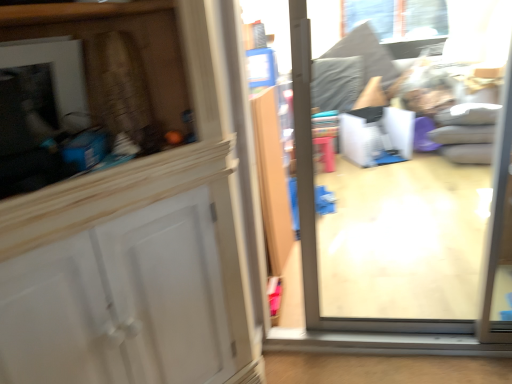
Question: From a real-world perspective, is transparent glass door at center positioned above or below clear glass window at upper center?

Choices:
 (A) above
 (B) below

Answer: (B)

Question: Is transparent glass door at center bigger or smaller than clear glass window at upper center?

Choices:
 (A) big
 (B) small

Answer: (A)

Question: Based on their positions, is transparent glass door at center located to the left or right of clear glass window at upper center?

Choices:
 (A) right
 (B) left

Answer: (B)

Question: Considering the positions of clear glass window at upper center and transparent glass door at center in the image, is clear glass window at upper center taller or shorter than transparent glass door at center?

Choices:
 (A) short
 (B) tall

Answer: (A)

Question: From a real-world perspective, is clear glass window at upper center positioned above or below transparent glass door at center?

Choices:
 (A) below
 (B) above

Answer: (B)

Question: From the image's perspective, is clear glass window at upper center positioned above or below transparent glass door at center?

Choices:
 (A) above
 (B) below

Answer: (A)

Question: Is point (422, 36) positioned closer to the camera than point (428, 165)?

Choices:
 (A) closer
 (B) farther

Answer: (B)